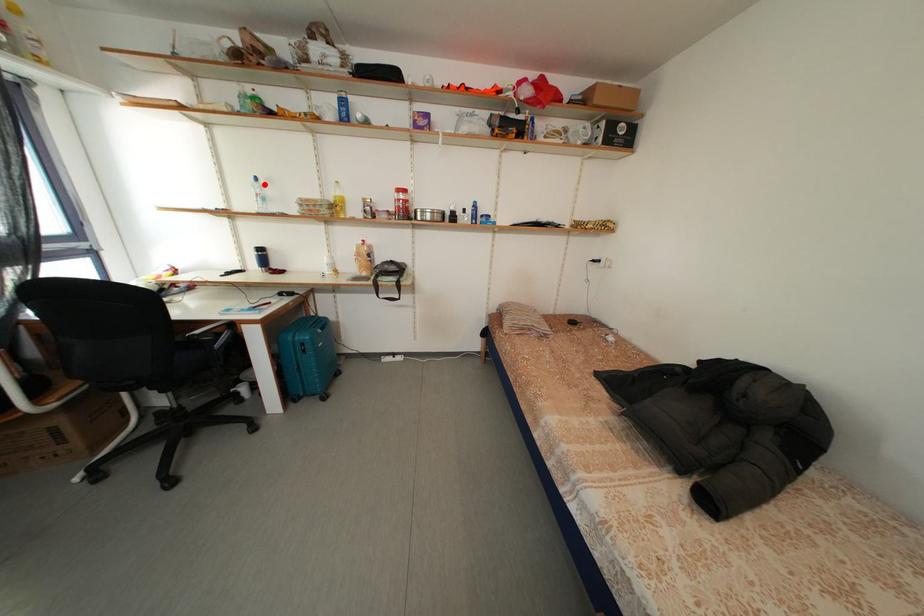
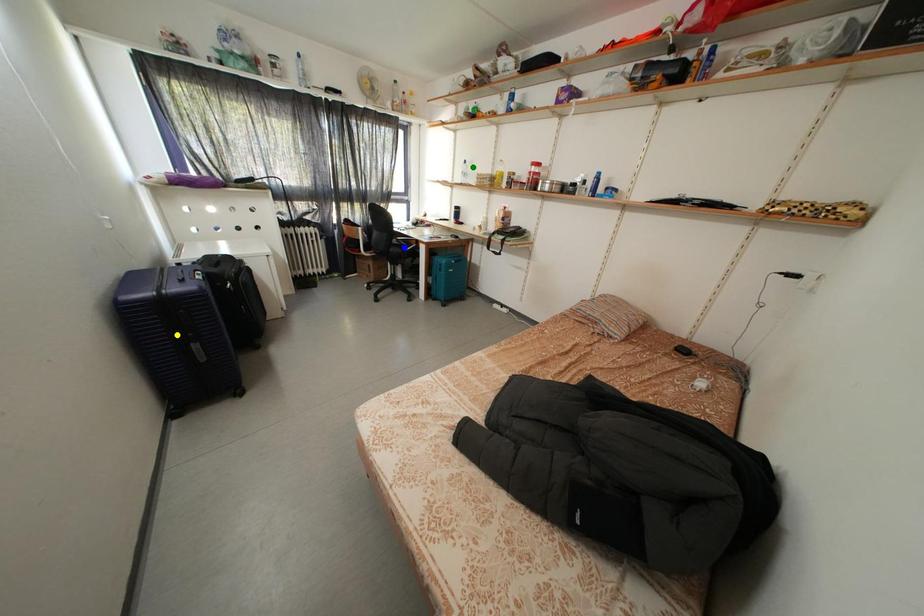
Question: I am providing you with two images of the same scene from different viewpoints. A red point is marked on the first image. You are given multiple points on the second image. In image 2, which mark is for the same physical point as the one in image 1?

Choices:
 (A) yellow point
 (B) green point
 (C) blue point

Answer: (B)